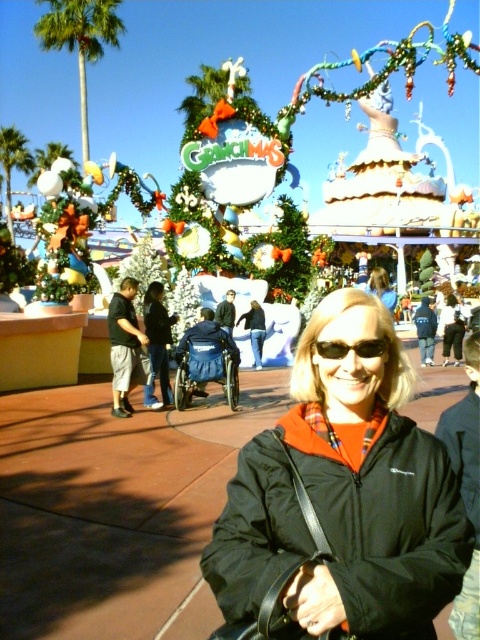
Question: Considering the relative positions of green leafy palm tree at upper left and matte blue shirt at center in the image provided, where is green leafy palm tree at upper left located with respect to matte blue shirt at center?

Choices:
 (A) left
 (B) right

Answer: (A)

Question: Which of these objects is positioned closest to the black plastic sunglasses at center?

Choices:
 (A) matte blue shirt at center
 (B) black matte jacket at center
 (C) green leafy palm tree at upper left

Answer: (B)

Question: Does black plastic sunglasses at center appear on the right side of matte blue shirt at center?

Choices:
 (A) no
 (B) yes

Answer: (A)

Question: Which point is farther to the camera?

Choices:
 (A) matte blue shirt at center
 (B) black matte jacket at center
 (C) black plastic sunglasses at center
 (D) green leafy palm tree at upper left

Answer: (D)

Question: Does black matte jacket at center come behind green leafy palm tree at upper left?

Choices:
 (A) yes
 (B) no

Answer: (B)

Question: Which point appears farthest from the camera in this image?

Choices:
 (A) (336, 540)
 (B) (358, 355)
 (C) (370, 275)

Answer: (C)